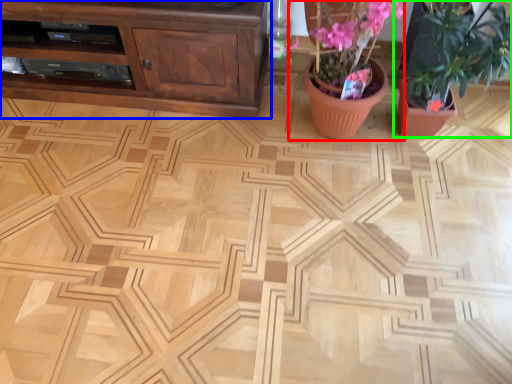
Question: Which object is positioned farthest from floral arrangement (highlighted by a red box)? Select from cabinetry (highlighted by a blue box) and houseplant (highlighted by a green box).

Choices:
 (A) cabinetry
 (B) houseplant

Answer: (A)